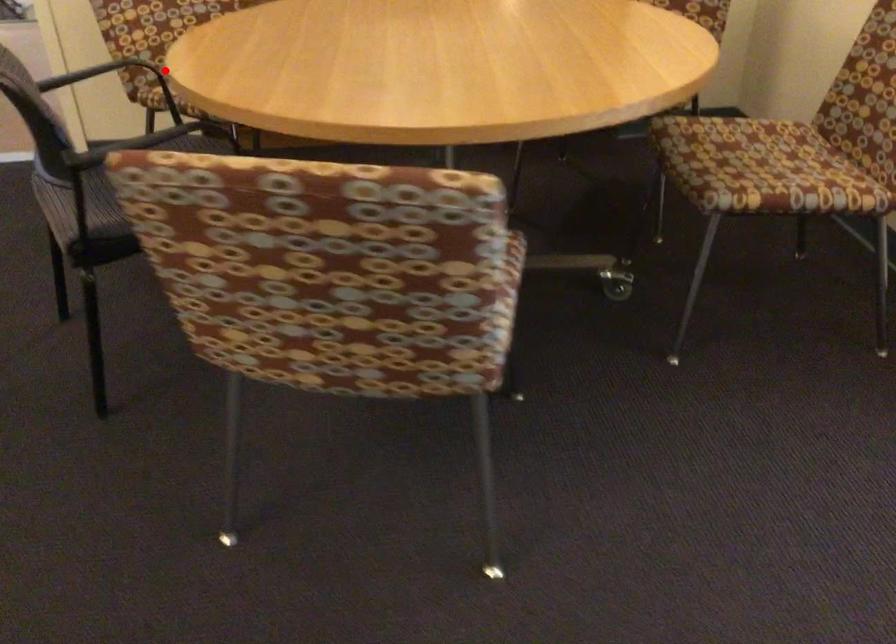
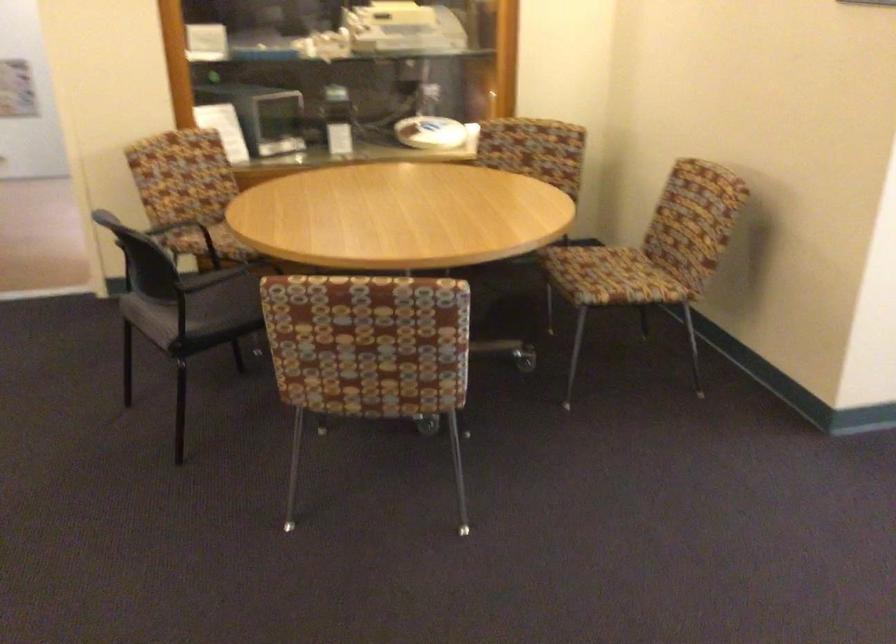
Find the pixel in the second image that matches the highlighted location in the first image.

(228, 229)